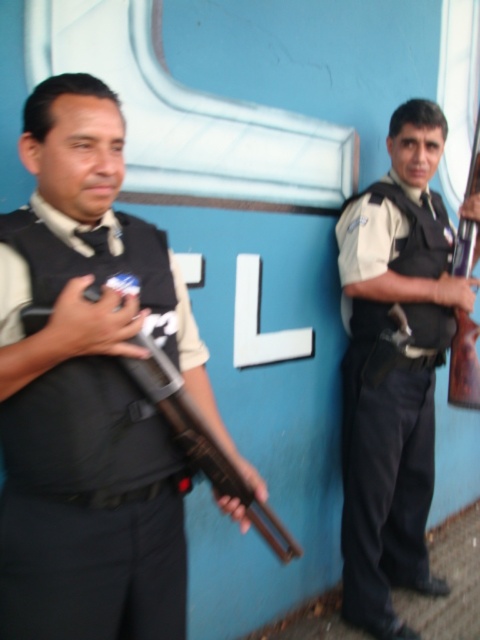
Question: Does matte black vest at center appear under wooden rifle at right?

Choices:
 (A) no
 (B) yes

Answer: (B)

Question: Does matte black rifle at left come in front of matte black shotgun at left?

Choices:
 (A) no
 (B) yes

Answer: (B)

Question: Which point appears closest to the camera in this image?

Choices:
 (A) [x=133, y=374]
 (B) [x=81, y=563]

Answer: (B)

Question: Which object appears farthest from the camera in this image?

Choices:
 (A) matte black vest at center
 (B) matte black shotgun at left
 (C) wooden rifle at right

Answer: (C)

Question: Is matte black shotgun at left wider than wooden rifle at right?

Choices:
 (A) no
 (B) yes

Answer: (B)

Question: Which object is positioned farthest from the wooden rifle at right?

Choices:
 (A) matte black shotgun at left
 (B) matte black rifle at left
 (C) matte black vest at center

Answer: (B)